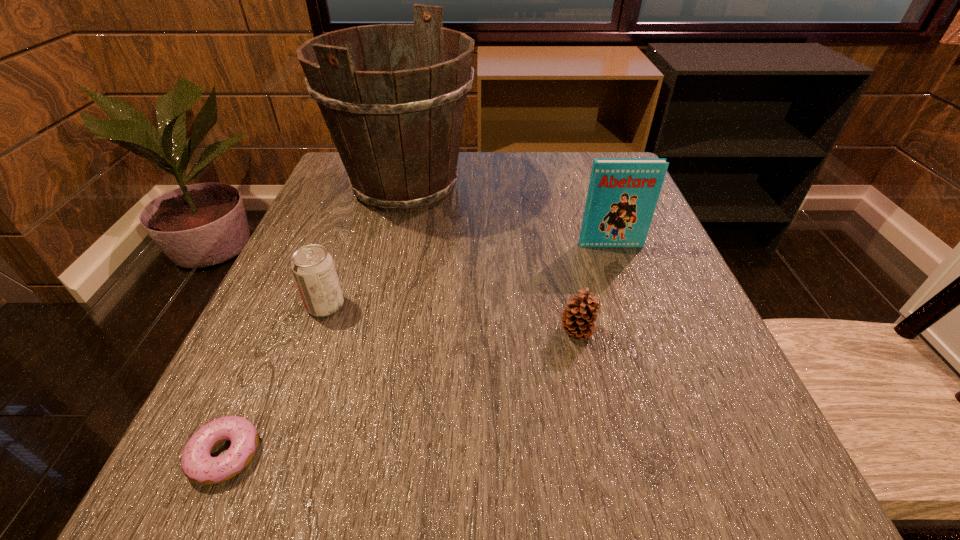
The width and height of the screenshot is (960, 540). Identify the location of free location located on the front cover of the rightmost object. (654, 365).

Image resolution: width=960 pixels, height=540 pixels. Identify the location of vacant area located 0.360m on the right of the soda can. (558, 305).

At what (x,y) coordinates should I click in order to perform the action: click on vacant space located on the front of the pinecone. Please return your answer as a coordinate pair (x, y). This screenshot has height=540, width=960. Looking at the image, I should click on (587, 379).

This screenshot has width=960, height=540. What are the coordinates of `vacant region located on the right of the doughnut` in the screenshot? It's located at (516, 454).

I want to click on object situated at the far edge, so click(x=398, y=132).

Locate an element on the screen. object that is at the near edge is located at coordinates (198, 465).

Locate an element on the screen. bucket present at the left edge is located at coordinates (398, 132).

Locate an element on the screen. The image size is (960, 540). soda can that is at the left edge is located at coordinates (313, 268).

Find the location of a particular element. The width and height of the screenshot is (960, 540). doughnut at the left edge is located at coordinates (198, 465).

I want to click on object at the right edge, so click(x=622, y=195).